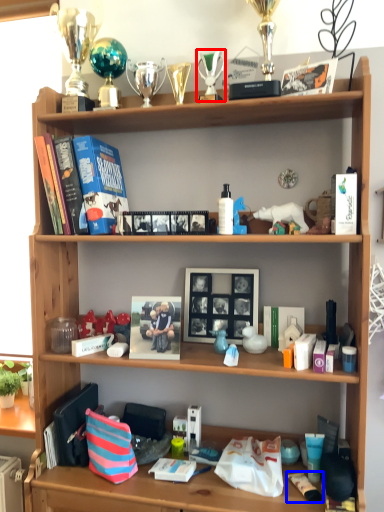
Question: Which point is further to the camera, toy (highlighted by a red box) or toiletry (highlighted by a blue box)?

Choices:
 (A) toy
 (B) toiletry

Answer: (A)